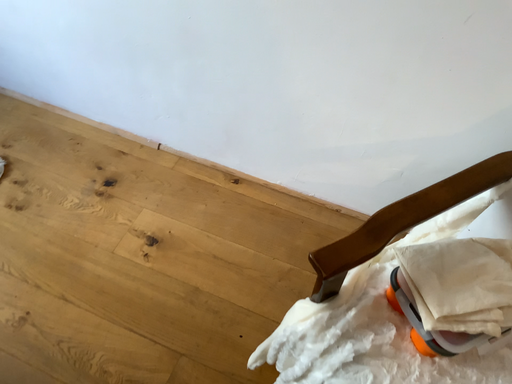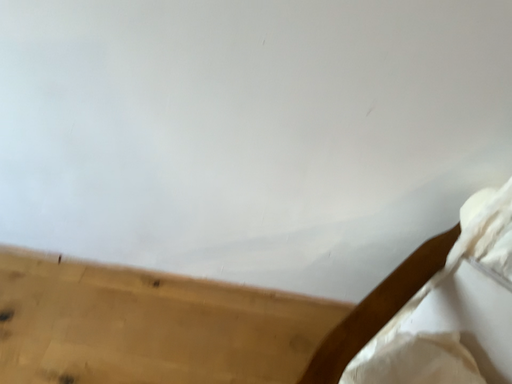
Question: Which way did the camera rotate in the video?

Choices:
 (A) rotated right
 (B) rotated left

Answer: (A)